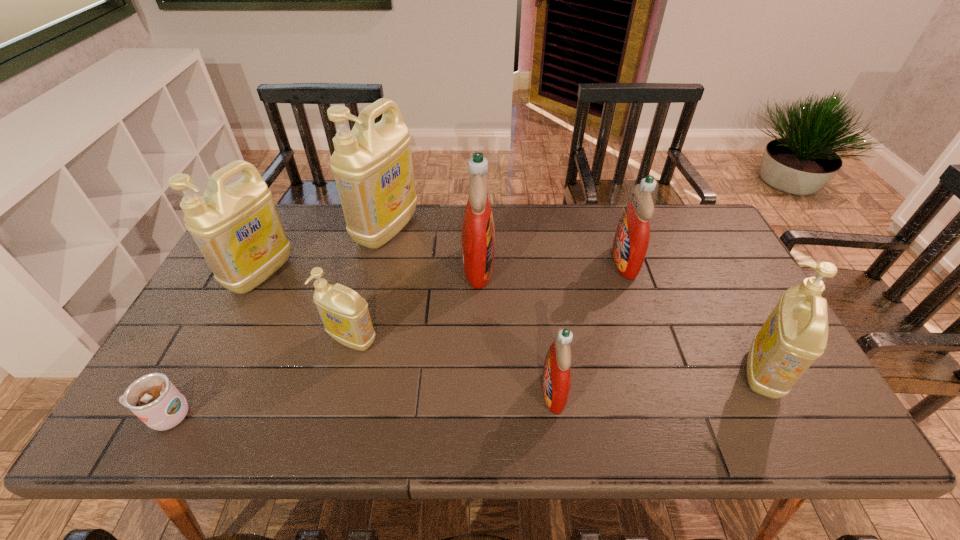
Locate which beige detergent ranks fourth in proximity to the smallest red detergent. Please provide its 2D coordinates. Your answer should be formatted as a tuple, i.e. [(x, y)], where the tuple contains the x and y coordinates of a point satisfying the conditions above.

[(237, 228)]

Identify which beige detergent is the third nearest to the smallest beige detergent. Please provide its 2D coordinates. Your answer should be formatted as a tuple, i.e. [(x, y)], where the tuple contains the x and y coordinates of a point satisfying the conditions above.

[(795, 334)]

Locate an element on the screen. red detergent identified as the second closest to the cup is located at coordinates (x=556, y=382).

Identify the location of red detergent that is the third nearest to the shortest object. The width and height of the screenshot is (960, 540). (x=631, y=240).

The image size is (960, 540). Identify the location of free space that satisfies the following two spatial constraints: 1. on the front surface of the rightmost red detergent; 2. on the front side of the third smallest beige detergent. (628, 273).

The height and width of the screenshot is (540, 960). In order to click on free spot that satisfies the following two spatial constraints: 1. on the back side of the rightmost detergent; 2. on the front surface of the sixth detergent from left to right in this screenshot , I will do `click(705, 262)`.

Identify the location of free space in the image that satisfies the following two spatial constraints: 1. on the front surface of the biggest red detergent; 2. on the front side of the leftmost beige detergent. This screenshot has width=960, height=540. (478, 273).